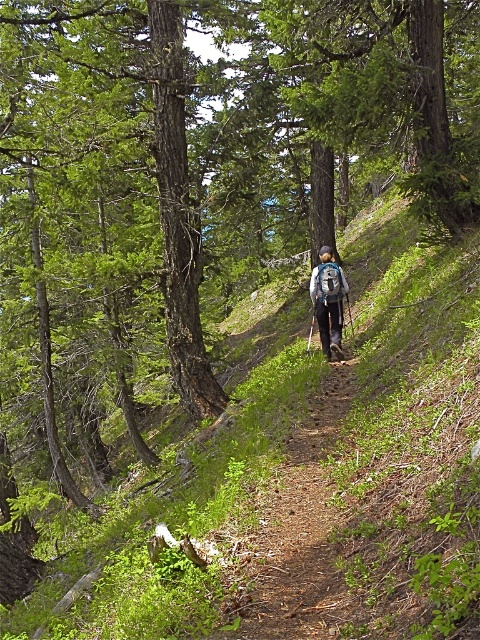
Is brown dirt path at center shorter than blue fabric backpack at center?

Indeed, brown dirt path at center has a lesser height compared to blue fabric backpack at center.

Does brown dirt path at center appear on the right side of blue fabric backpack at center?

Incorrect, brown dirt path at center is not on the right side of blue fabric backpack at center.

What do you see at coordinates (296, 531) in the screenshot? I see `brown dirt path at center` at bounding box center [296, 531].

Locate an element on the screen. The width and height of the screenshot is (480, 640). brown dirt path at center is located at coordinates (296, 531).